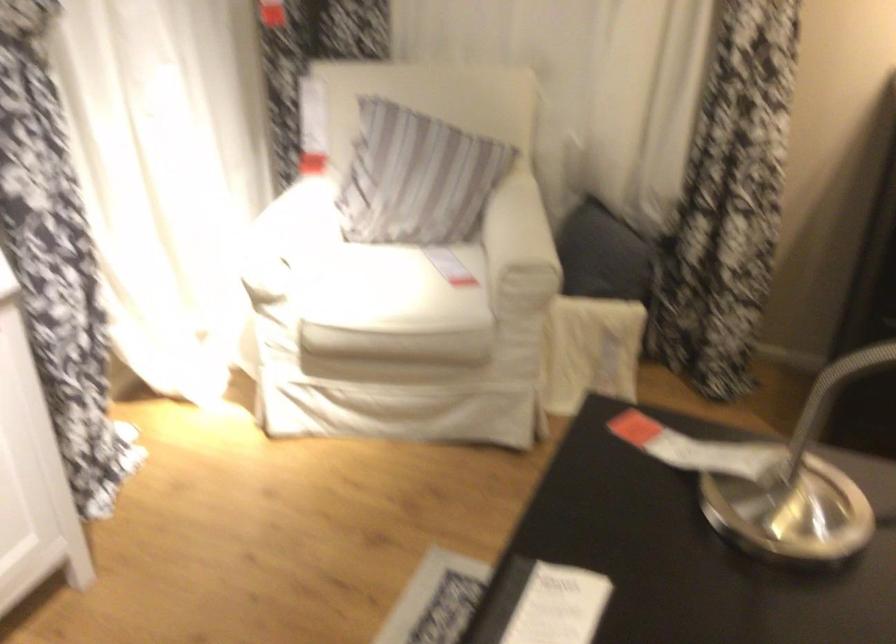
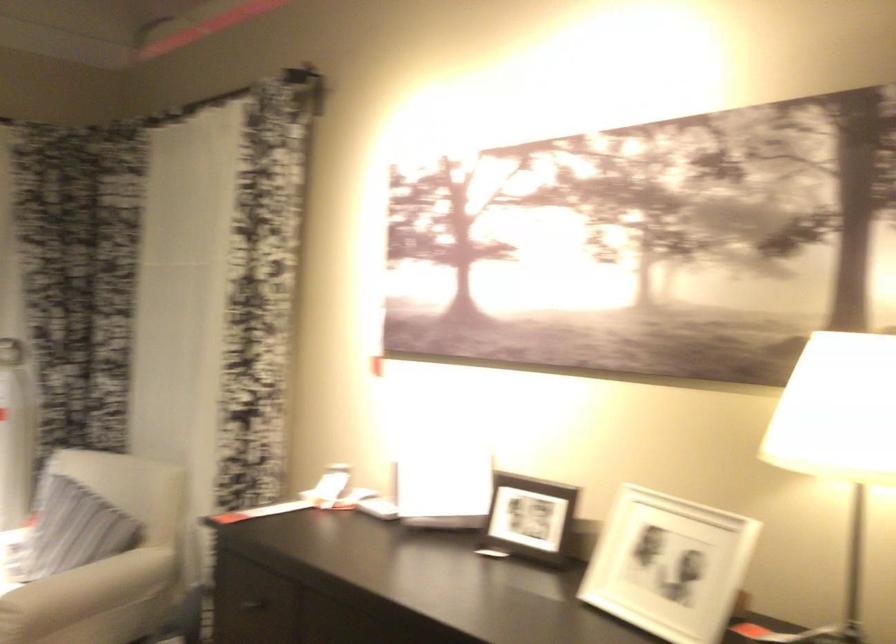
Find the pixel in the second image that matches point 280,167 in the first image.

(29, 513)